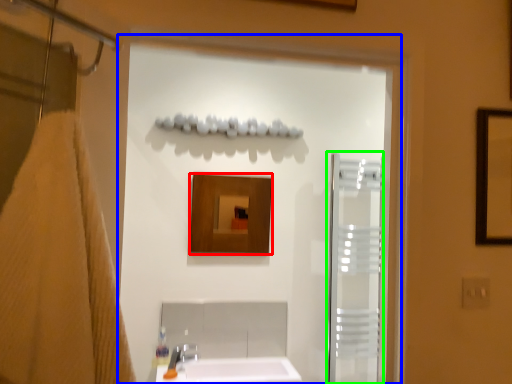
Question: Which object is positioned farthest from mirror (highlighted by a red box)? Select from screen door (highlighted by a blue box) and screen door (highlighted by a green box).

Choices:
 (A) screen door
 (B) screen door

Answer: (B)